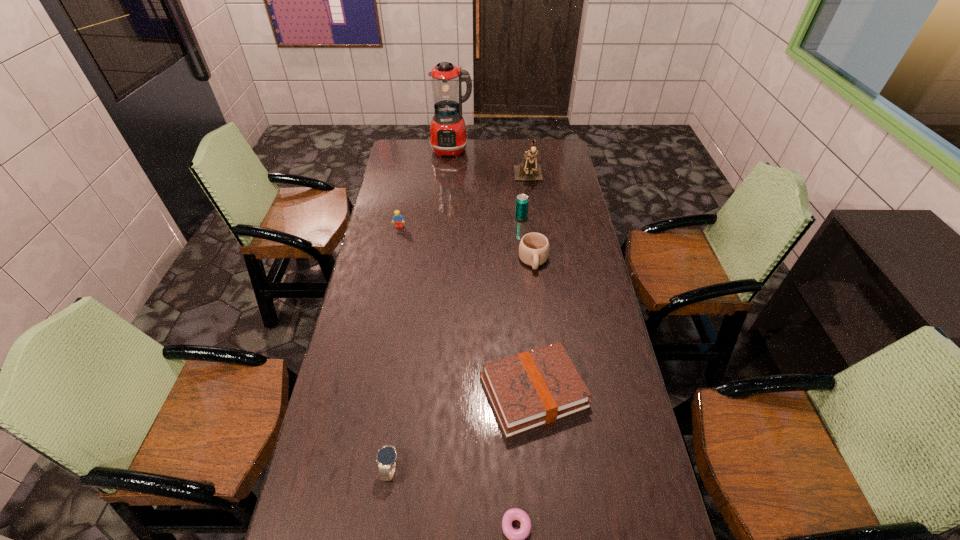
The width and height of the screenshot is (960, 540). Identify the location of hardback book. (534, 388).

At what (x,y) coordinates should I click in order to perform the action: click on free point located 0.280m on the controls of the food processor. Please return your answer as a coordinate pair (x, y). The height and width of the screenshot is (540, 960). Looking at the image, I should click on (448, 192).

Where is `free space located on the front-facing side of the seventh nearest object`? The image size is (960, 540). free space located on the front-facing side of the seventh nearest object is located at coordinates (532, 200).

You are a GUI agent. You are given a task and a screenshot of the screen. Output one action in this format:
    pyautogui.click(x=<x>, y=<y>)
    Task: Click on the vacant region located 0.060m on the back of the third tallest object
    
    Given the screenshot: What is the action you would take?
    pyautogui.click(x=519, y=205)

This screenshot has width=960, height=540. I want to click on vacant space located 0.360m on the side of the mug with the handle, so click(x=544, y=355).

Where is `vacant space situated 0.270m on the face of the leftmost object`? The image size is (960, 540). vacant space situated 0.270m on the face of the leftmost object is located at coordinates (390, 274).

The height and width of the screenshot is (540, 960). What are the coordinates of `vacant area situated on the back of the watch` in the screenshot? It's located at (402, 389).

At what (x,y) coordinates should I click in order to perform the action: click on free space located on the back of the third nearest object. Please return your answer as a coordinate pair (x, y). The image size is (960, 540). Looking at the image, I should click on (528, 329).

Locate an element on the screen. The image size is (960, 540). object present at the far edge is located at coordinates (448, 137).

I want to click on object situated at the left edge, so 398,218.